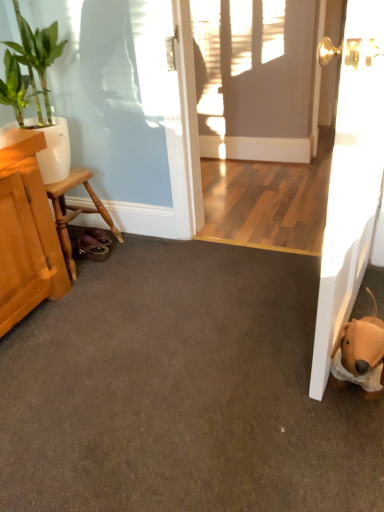
Where is `free spot to the left of white glossy door at right`? free spot to the left of white glossy door at right is located at coordinates (218, 330).